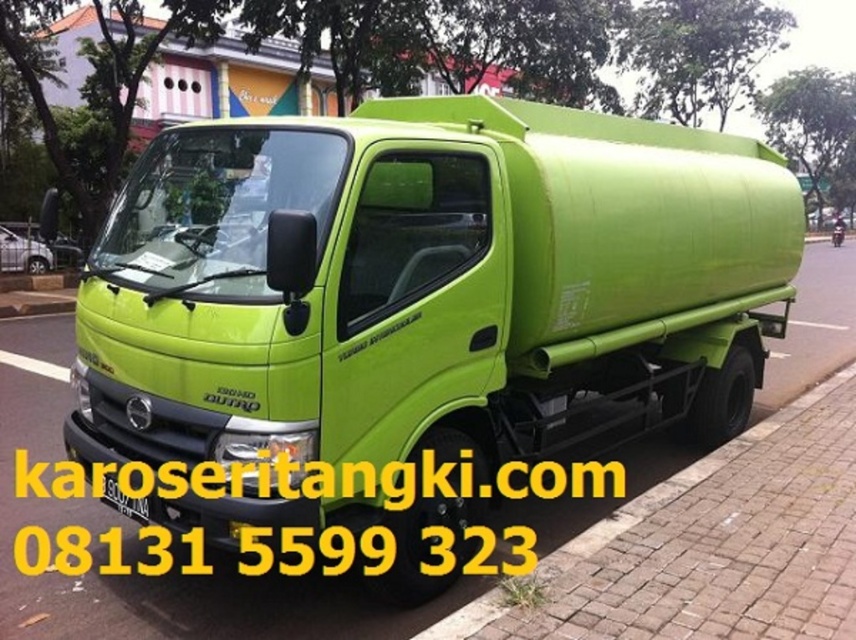
Question: Considering the relative positions of green matte truck at center and brick pavement at lower right in the image provided, where is green matte truck at center located with respect to brick pavement at lower right?

Choices:
 (A) below
 (B) above

Answer: (B)

Question: Does brick pavement at lower right appear over yellow matte license plate at center?

Choices:
 (A) no
 (B) yes

Answer: (A)

Question: Among these points, which one is nearest to the camera?

Choices:
 (A) (597, 307)
 (B) (140, 515)

Answer: (B)

Question: Does green matte truck at center have a larger size compared to brick pavement at lower right?

Choices:
 (A) no
 (B) yes

Answer: (B)

Question: Which of the following is the farthest from the observer?

Choices:
 (A) green matte truck at center
 (B) yellow matte license plate at center

Answer: (B)

Question: Which point is farther to the camera?

Choices:
 (A) (434, 632)
 (B) (146, 499)

Answer: (B)